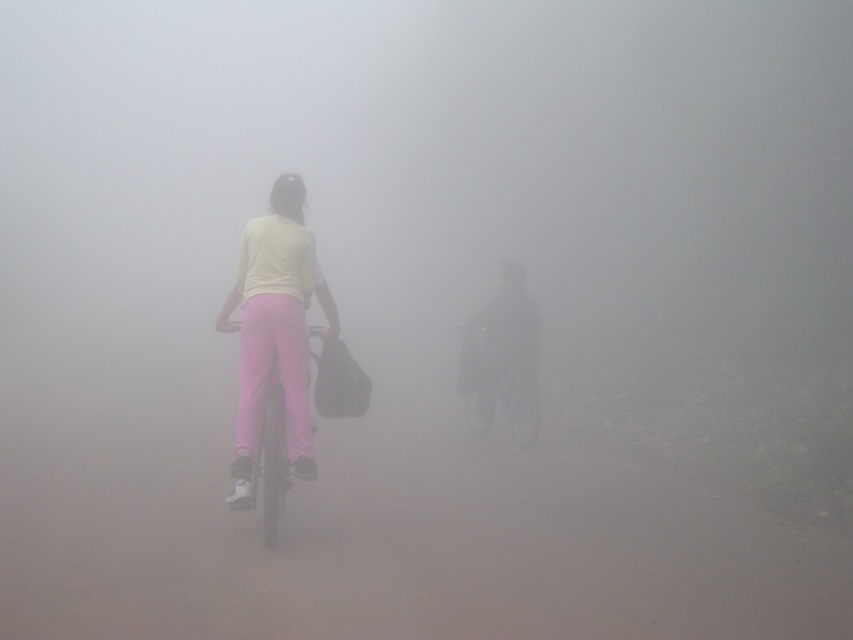
Question: Can you confirm if dark matte jacket at center is positioned below pink matte pants at center?

Choices:
 (A) yes
 (B) no

Answer: (B)

Question: Is matte pink pants at center wider than dark matte jacket at center?

Choices:
 (A) yes
 (B) no

Answer: (A)

Question: Is dark matte jacket at center closer to the viewer compared to pink matte pants at center?

Choices:
 (A) no
 (B) yes

Answer: (A)

Question: Which is farther from the matte pink bicycle at center?

Choices:
 (A) pink matte pants at center
 (B) matte pink pants at center

Answer: (A)

Question: Which of the following is the closest to the observer?

Choices:
 (A) matte pink pants at center
 (B) dark matte jacket at center
 (C) matte pink bicycle at center
 (D) pink matte pants at center

Answer: (C)

Question: Which is farther from the pink matte pants at center?

Choices:
 (A) dark matte jacket at center
 (B) matte pink pants at center
 (C) matte pink bicycle at center

Answer: (A)